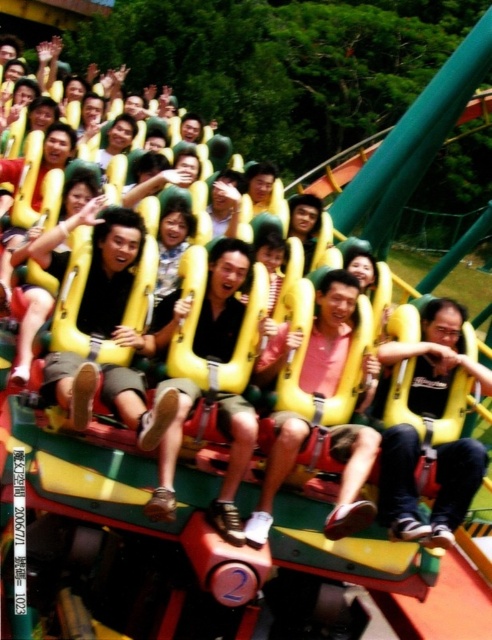
Does pink matte shirt at center appear on the left side of matte black shirt at center?

Incorrect, pink matte shirt at center is not on the left side of matte black shirt at center.

Who is more forward, (333,362) or (214,515)?

Point (214,515) is more forward.

Identify the location of pink matte shirt at center. (330, 332).

Is dark blue jeans at center bigger than matte black shirt at center?

No, dark blue jeans at center is not bigger than matte black shirt at center.

Is dark blue jeans at center closer to camera compared to matte black shirt at center?

Yes, it is in front of matte black shirt at center.

Does point (377, 410) come behind point (173, 477)?

Yes, it is.

Identify the location of dark blue jeans at center. The height and width of the screenshot is (640, 492). (435, 481).

In the scene shown: Is dark blue jeans at center shorter than pink matte shirt at center?

Correct, dark blue jeans at center is not as tall as pink matte shirt at center.

Does dark blue jeans at center have a greater height compared to pink matte shirt at center?

In fact, dark blue jeans at center may be shorter than pink matte shirt at center.

Which is in front, point (423, 532) or point (268, 349)?

Positioned in front is point (423, 532).

Identify the location of dark blue jeans at center. This screenshot has height=640, width=492. (435, 481).